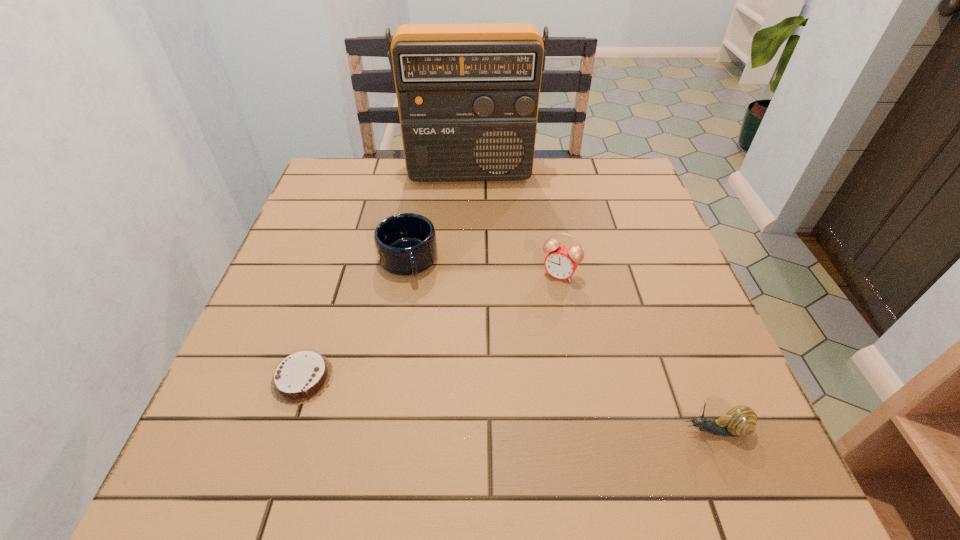
The image size is (960, 540). Find the location of `the fourth farthest object`. the fourth farthest object is located at coordinates (301, 377).

Identify the location of the leftmost object. The image size is (960, 540). (301, 377).

Locate an element on the screen. Image resolution: width=960 pixels, height=540 pixels. the rightmost object is located at coordinates (740, 420).

You are a GUI agent. You are given a task and a screenshot of the screen. Output one action in this format:
    pyautogui.click(x=<x>, y=<y>)
    Task: Click on the nearest object
    The width and height of the screenshot is (960, 540).
    Given the screenshot: What is the action you would take?
    pyautogui.click(x=740, y=420)

Locate an element on the screen. The width and height of the screenshot is (960, 540). the tallest object is located at coordinates (468, 95).

The width and height of the screenshot is (960, 540). Find the location of `radio receiver`. radio receiver is located at coordinates (468, 95).

Find the location of `the second tallest object`. the second tallest object is located at coordinates (561, 262).

The image size is (960, 540). I want to click on mug, so click(x=405, y=243).

At what (x,y) coordinates should I click in order to perform the action: click on vacant space located 0.180m on the right of the leftmost object. Please return your answer as a coordinate pair (x, y). This screenshot has width=960, height=540. Looking at the image, I should click on (430, 378).

Locate an element on the screen. This screenshot has width=960, height=540. vacant space located on the front-facing side of the rightmost object is located at coordinates (653, 430).